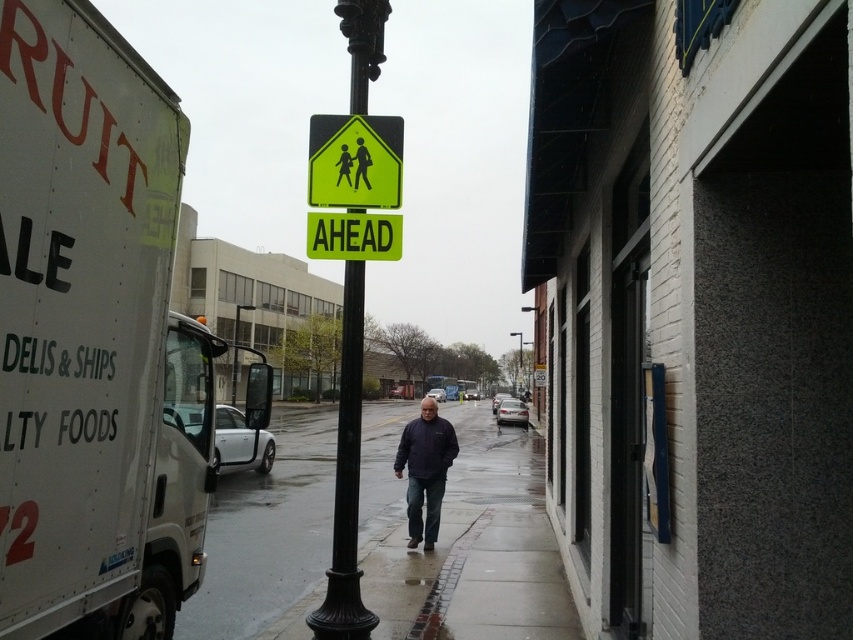
Question: Is black metal pole at center positioned in front of yellow reflective pedestrian sign at center?

Choices:
 (A) no
 (B) yes

Answer: (B)

Question: Is black metal pole at center to the right of dark blue jacket at center from the viewer's perspective?

Choices:
 (A) yes
 (B) no

Answer: (B)

Question: Which of the following is the farthest from the observer?

Choices:
 (A) (358, 172)
 (B) (350, 182)

Answer: (A)

Question: Is yellow reflective plastic pedestrian crossing sign at center thinner than dark blue jacket at center?

Choices:
 (A) yes
 (B) no

Answer: (A)

Question: Which object is the closest to the dark blue jacket at center?

Choices:
 (A) green matte pedestrian crossing sign at center
 (B) yellow reflective plastic pedestrian crossing sign at center

Answer: (B)

Question: Based on their relative distances, which object is farther from the yellow reflective pedestrian sign at center?

Choices:
 (A) green matte pedestrian crossing sign at center
 (B) dark blue jacket at center
 (C) matte yellow pedestrian sign at center
 (D) black metal pole at center

Answer: (B)